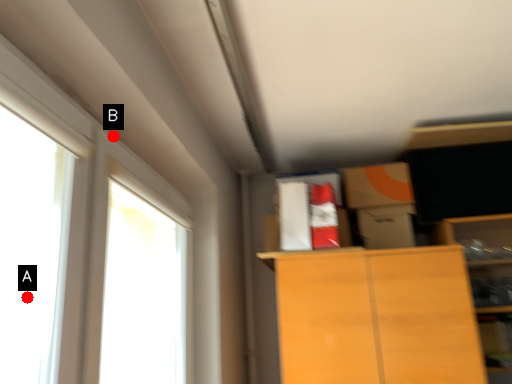
Question: Two points are circled on the image, labeled by A and B beside each circle. Which point appears closest to the camera in this image?

Choices:
 (A) A is closer
 (B) B is closer

Answer: (B)